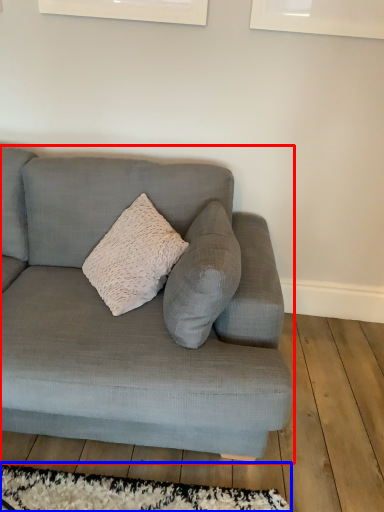
Question: Which point is closer to the camera, studio couch (highlighted by a red box) or mat (highlighted by a blue box)?

Choices:
 (A) studio couch
 (B) mat

Answer: (A)